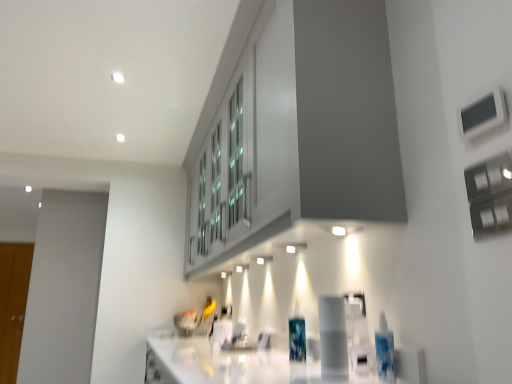
Question: From a real-world perspective, is translucent plastic bottle at center positioned above or below wooden glass door at left?

Choices:
 (A) above
 (B) below

Answer: (B)

Question: Is point (303, 327) closer or farther from the camera than point (2, 332)?

Choices:
 (A) closer
 (B) farther

Answer: (A)

Question: Which object is the closest to the wooden glass door at left?

Choices:
 (A) white glossy countertop at lower center
 (B) translucent plastic bottle at center

Answer: (A)

Question: Estimate the real-world distances between objects in this image. Which object is closer to the wooden glass door at left?

Choices:
 (A) white glossy countertop at lower center
 (B) translucent plastic bottle at center

Answer: (A)